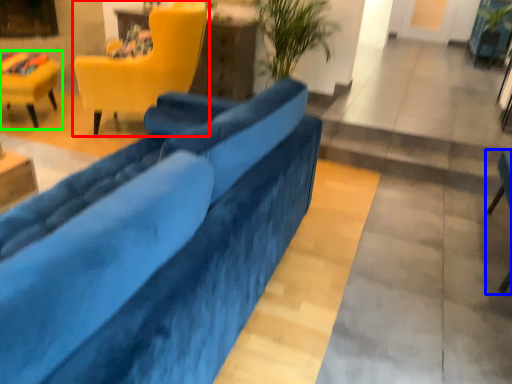
Question: Based on their relative distances, which object is farther from chair (highlighted by a red box)? Choose from chair (highlighted by a blue box) and chair (highlighted by a green box).

Choices:
 (A) chair
 (B) chair

Answer: (A)